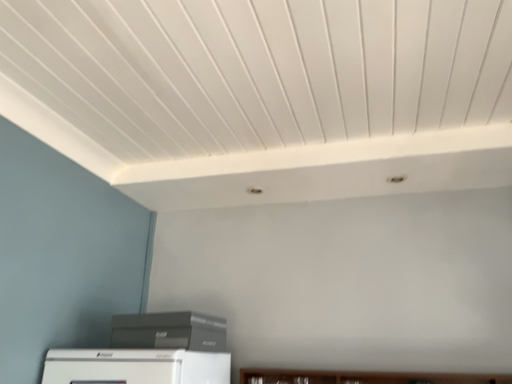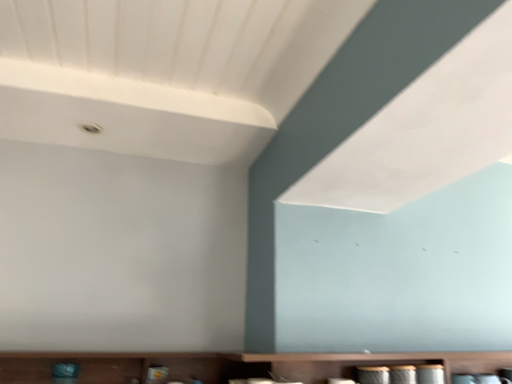
Question: How did the camera likely rotate when shooting the video?

Choices:
 (A) rotated right
 (B) rotated left

Answer: (A)